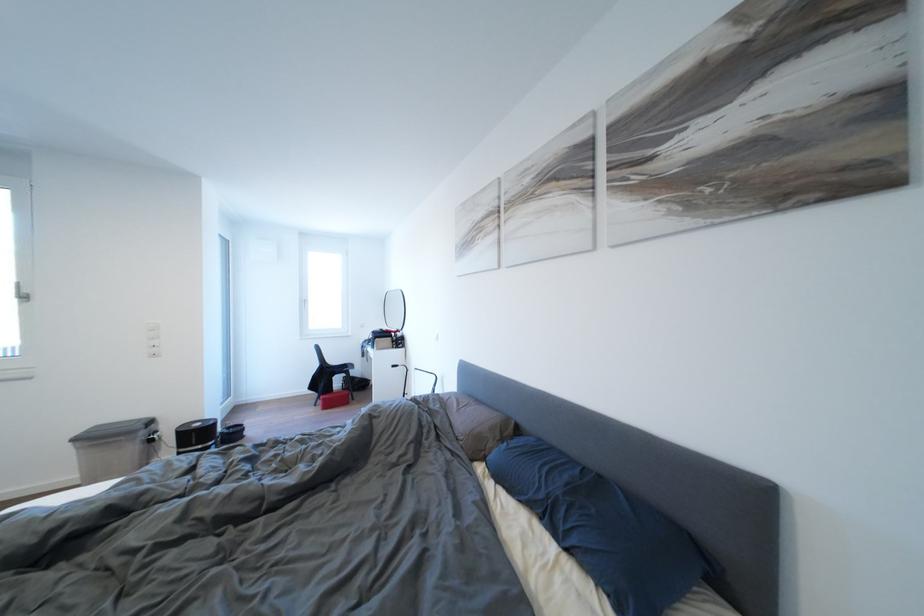
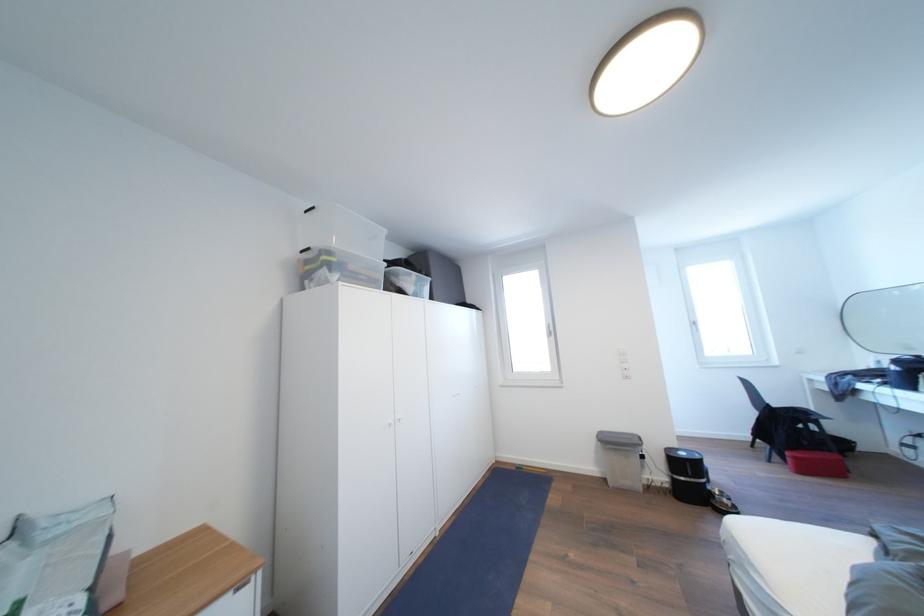
Where in the second image is the point corresponding to the point at 332,405 from the first image?

(803, 463)